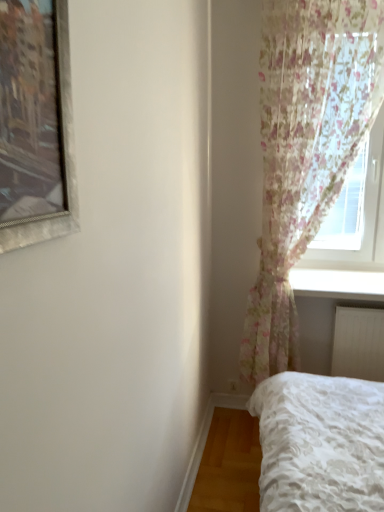
Question: Should I look upward or downward to see white glossy window sill at lower right?

Choices:
 (A) down
 (B) up

Answer: (A)

Question: Would you say floral sheer curtain at right is part of white plastic radiator at lower right's contents?

Choices:
 (A) yes
 (B) no

Answer: (B)

Question: Can you confirm if white plastic radiator at lower right is taller than floral sheer curtain at right?

Choices:
 (A) no
 (B) yes

Answer: (A)

Question: Is the depth of white plastic radiator at lower right less than that of floral sheer curtain at right?

Choices:
 (A) yes
 (B) no

Answer: (B)

Question: Is white plastic radiator at lower right facing away from floral sheer curtain at right?

Choices:
 (A) no
 (B) yes

Answer: (B)

Question: Is white plastic radiator at lower right to the left of floral sheer curtain at right from the viewer's perspective?

Choices:
 (A) no
 (B) yes

Answer: (A)

Question: From a real-world perspective, is white plastic radiator at lower right located beneath floral sheer curtain at right?

Choices:
 (A) no
 (B) yes

Answer: (B)

Question: Is white plastic radiator at lower right looking in the opposite direction of white glossy window sill at lower right?

Choices:
 (A) no
 (B) yes

Answer: (A)

Question: Is white plastic radiator at lower right completely or partially outside of white glossy window sill at lower right?

Choices:
 (A) no
 (B) yes

Answer: (B)

Question: From a real-world perspective, is white plastic radiator at lower right over white glossy window sill at lower right?

Choices:
 (A) no
 (B) yes

Answer: (A)

Question: Is white plastic radiator at lower right to the right of white glossy window sill at lower right from the viewer's perspective?

Choices:
 (A) no
 (B) yes

Answer: (B)

Question: Is white plastic radiator at lower right in contact with white glossy window sill at lower right?

Choices:
 (A) yes
 (B) no

Answer: (B)

Question: Is the depth of white plastic radiator at lower right less than that of white glossy window sill at lower right?

Choices:
 (A) no
 (B) yes

Answer: (A)

Question: Is floral sheer curtain at right shorter than white glossy window sill at lower right?

Choices:
 (A) no
 (B) yes

Answer: (A)